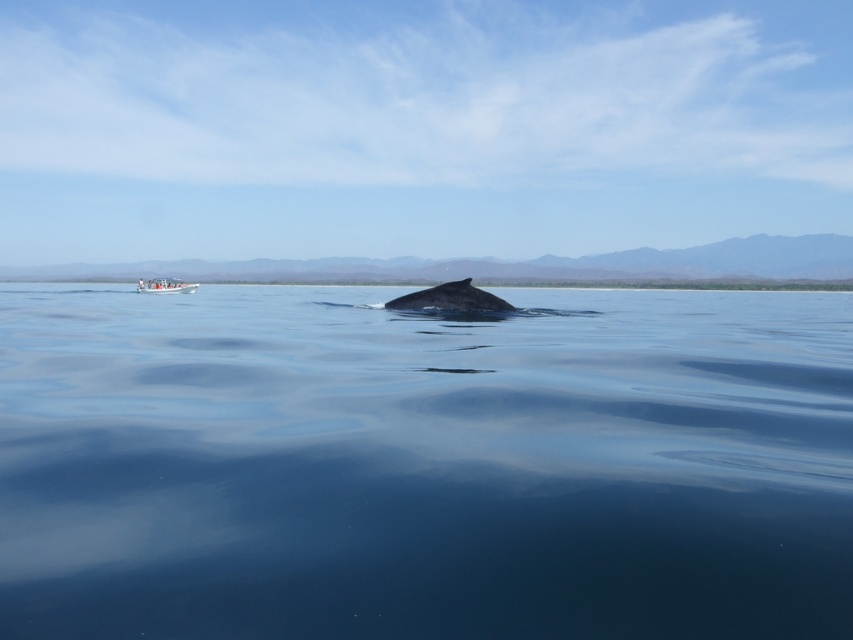
Does clear blue water at center have a greater height compared to white plastic boat at lower left?

Correct, clear blue water at center is much taller as white plastic boat at lower left.

Who is more forward, (654, 312) or (194, 288)?

Point (654, 312)

At what (x,y) coordinates should I click in order to perform the action: click on clear blue water at center. Please return your answer as a coordinate pair (x, y). Looking at the image, I should click on (424, 465).

The height and width of the screenshot is (640, 853). Describe the element at coordinates (424, 465) in the screenshot. I see `clear blue water at center` at that location.

From the picture: Who is more distant from viewer, [463,438] or [485,301]?

The point [485,301] is behind.

From the picture: Who is more forward, (402, 355) or (392, 304)?

Positioned in front is point (402, 355).

The height and width of the screenshot is (640, 853). What are the coordinates of `clear blue water at center` in the screenshot? It's located at (424, 465).

Is point (392, 300) farther from viewer compared to point (167, 292)?

That is False.

Who is positioned more to the right, smooth gray whale at center or white plastic boat at lower left?

Positioned to the right is smooth gray whale at center.

The height and width of the screenshot is (640, 853). I want to click on smooth gray whale at center, so click(450, 298).

This screenshot has width=853, height=640. Identify the location of smooth gray whale at center. (450, 298).